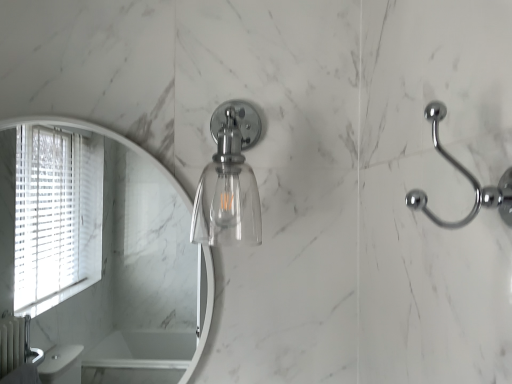
Question: Can you confirm if clear glass light fixture at center is taller than polished chrome hook at right?

Choices:
 (A) no
 (B) yes

Answer: (B)

Question: From a real-world perspective, is clear glass light fixture at center under polished chrome hook at right?

Choices:
 (A) yes
 (B) no

Answer: (B)

Question: Does clear glass light fixture at center lie behind polished chrome hook at right?

Choices:
 (A) yes
 (B) no

Answer: (A)

Question: Considering the relative sizes of clear glass light fixture at center and polished chrome hook at right in the image provided, is clear glass light fixture at center smaller than polished chrome hook at right?

Choices:
 (A) no
 (B) yes

Answer: (A)

Question: Is clear glass light fixture at center not within polished chrome hook at right?

Choices:
 (A) no
 (B) yes

Answer: (B)

Question: Does clear glass light fixture at center have a larger size compared to polished chrome hook at right?

Choices:
 (A) no
 (B) yes

Answer: (B)

Question: Would you say polished chrome hook at right is a long distance from clear glass light fixture at center?

Choices:
 (A) no
 (B) yes

Answer: (A)

Question: Is polished chrome hook at right at the right side of clear glass light fixture at center?

Choices:
 (A) no
 (B) yes

Answer: (B)

Question: Is polished chrome hook at right taller than clear glass light fixture at center?

Choices:
 (A) no
 (B) yes

Answer: (A)

Question: Is clear glass light fixture at center surrounded by polished chrome hook at right?

Choices:
 (A) no
 (B) yes

Answer: (A)

Question: Can we say polished chrome hook at right lies outside clear glass light fixture at center?

Choices:
 (A) no
 (B) yes

Answer: (B)

Question: Can you confirm if polished chrome hook at right is shorter than clear glass light fixture at center?

Choices:
 (A) yes
 (B) no

Answer: (A)

Question: Visually, is polished chrome hook at right positioned to the left or to the right of clear glass light fixture at center?

Choices:
 (A) left
 (B) right

Answer: (B)